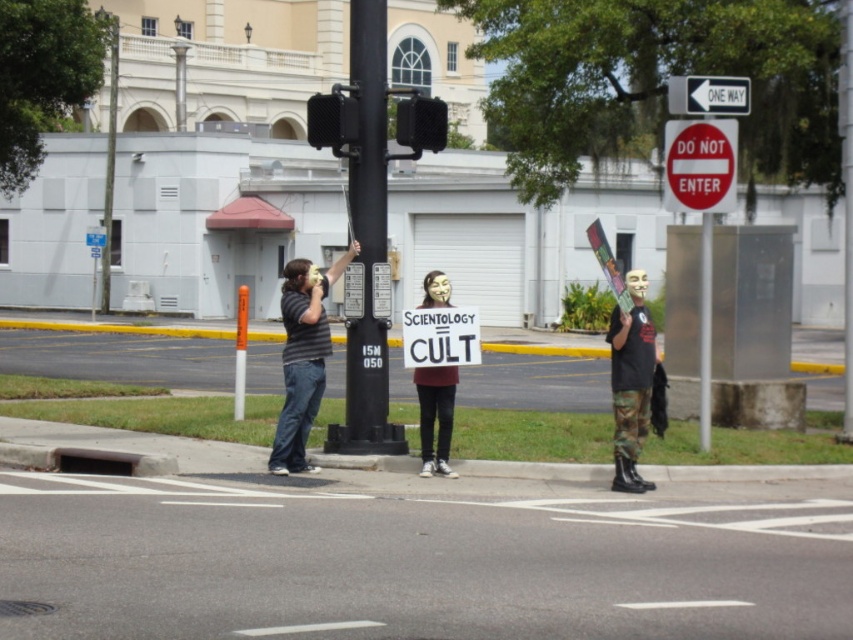
Does striped shirt at center have a lesser width compared to matte black sign at center?

No.

Looking at this image, can you confirm if striped shirt at center is positioned to the right of matte black sign at center?

In fact, striped shirt at center is to the left of matte black sign at center.

Between point (299, 284) and point (422, 372), which one is positioned behind?

Positioned behind is point (422, 372).

Where is `striped shirt at center`? The image size is (853, 640). striped shirt at center is located at coordinates (303, 356).

Is striped shirt at center above black plastic traffic light at upper center?

Incorrect, striped shirt at center is not positioned above black plastic traffic light at upper center.

Can you confirm if striped shirt at center is taller than black plastic traffic light at upper center?

Yes.

Image resolution: width=853 pixels, height=640 pixels. Identify the location of striped shirt at center. (303, 356).

Who is lower down, matte black sign at center or black plastic traffic light at upper center?

matte black sign at center

Who is taller, matte black sign at center or black plastic traffic light at upper center?

With more height is matte black sign at center.

Is point (450, 470) positioned behind point (404, 102)?

No, it is not.

You are a GUI agent. You are given a task and a screenshot of the screen. Output one action in this format:
    pyautogui.click(x=<x>, y=<y>)
    Task: Click on the matte black sign at center
    The width and height of the screenshot is (853, 640).
    Given the screenshot: What is the action you would take?
    pyautogui.click(x=434, y=417)